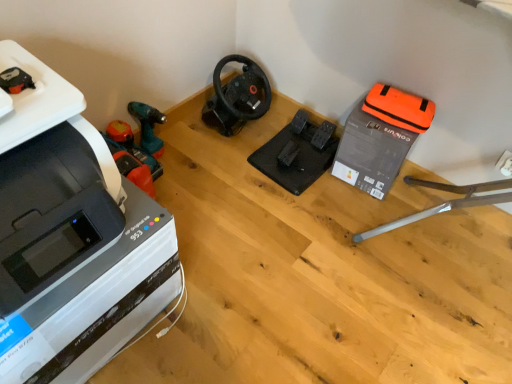
Question: From a real-world perspective, is orange fabric bag at upper right, which is the first equipment in right-to-left order, physically above black matte steering wheel at center, positioned as the first vacuum in right-to-left order?

Choices:
 (A) no
 (B) yes

Answer: (B)

Question: Is orange fabric bag at upper right, which appears as the second equipment when viewed from the left, positioned beyond the bounds of black matte steering wheel at center, positioned as the first vacuum in right-to-left order?

Choices:
 (A) no
 (B) yes

Answer: (B)

Question: Does orange fabric bag at upper right, which is the first equipment in right-to-left order, have a greater height compared to black matte steering wheel at center, positioned as the first vacuum in right-to-left order?

Choices:
 (A) yes
 (B) no

Answer: (A)

Question: From the image's perspective, is orange fabric bag at upper right, which is the first equipment in right-to-left order, above black matte steering wheel at center, positioned as the first vacuum in right-to-left order?

Choices:
 (A) no
 (B) yes

Answer: (A)

Question: Considering the relative sizes of orange fabric bag at upper right, which appears as the second equipment when viewed from the left, and black matte steering wheel at center, positioned as the first vacuum in right-to-left order, in the image provided, is orange fabric bag at upper right, which appears as the second equipment when viewed from the left, thinner than black matte steering wheel at center, positioned as the first vacuum in right-to-left order,?

Choices:
 (A) no
 (B) yes

Answer: (B)

Question: Considering their positions, is black matte steering wheel at center, the second vacuum positioned from the left, located in front of or behind orange plastic vacuum at left, which ranks as the 2th vacuum in right-to-left order?

Choices:
 (A) behind
 (B) front

Answer: (A)

Question: Is point (216, 124) closer or farther from the camera than point (118, 155)?

Choices:
 (A) farther
 (B) closer

Answer: (A)

Question: Based on their sizes in the image, would you say black matte steering wheel at center, positioned as the first vacuum in right-to-left order, is bigger or smaller than orange plastic vacuum at left, which ranks as the 2th vacuum in right-to-left order?

Choices:
 (A) small
 (B) big

Answer: (B)

Question: Is black matte steering wheel at center, positioned as the first vacuum in right-to-left order, wider or thinner than orange plastic vacuum at left, the first vacuum from the left?

Choices:
 (A) thin
 (B) wide

Answer: (B)

Question: Is white plastic printer at left wider or thinner than black matte steering wheel at center, the second vacuum positioned from the left?

Choices:
 (A) thin
 (B) wide

Answer: (B)

Question: Is white plastic printer at left inside the boundaries of black matte steering wheel at center, positioned as the first vacuum in right-to-left order, or outside?

Choices:
 (A) inside
 (B) outside

Answer: (B)

Question: From a real-world perspective, is white plastic printer at left physically located above or below black matte steering wheel at center, the second vacuum positioned from the left?

Choices:
 (A) above
 (B) below

Answer: (A)

Question: Considering the positions of point (165, 238) and point (247, 76), is point (165, 238) closer or farther from the camera than point (247, 76)?

Choices:
 (A) farther
 (B) closer

Answer: (B)

Question: Considering the positions of white plastic printer at left and orange fabric bag at upper right, which appears as the second equipment when viewed from the left, in the image, is white plastic printer at left wider or thinner than orange fabric bag at upper right, which appears as the second equipment when viewed from the left,?

Choices:
 (A) thin
 (B) wide

Answer: (B)

Question: Do you think white plastic printer at left is within orange fabric bag at upper right, which appears as the second equipment when viewed from the left, or outside of it?

Choices:
 (A) inside
 (B) outside

Answer: (B)